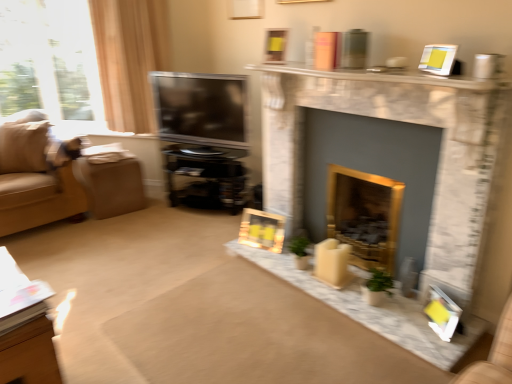
This screenshot has width=512, height=384. I want to click on free point behind matte white picture frame at lower right, the 3th picture frame positioned from the top, so click(x=413, y=300).